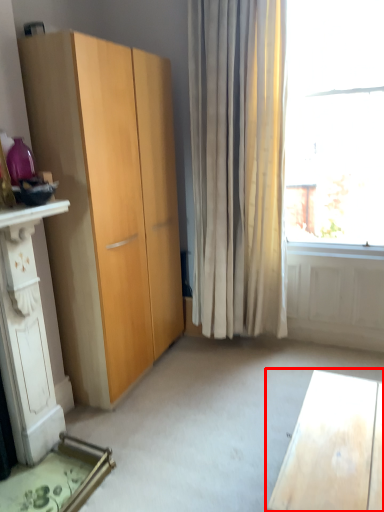
Question: Observing the image, what is the correct spatial positioning of desk (annotated by the red box) in reference to dresser?

Choices:
 (A) right
 (B) left

Answer: (A)